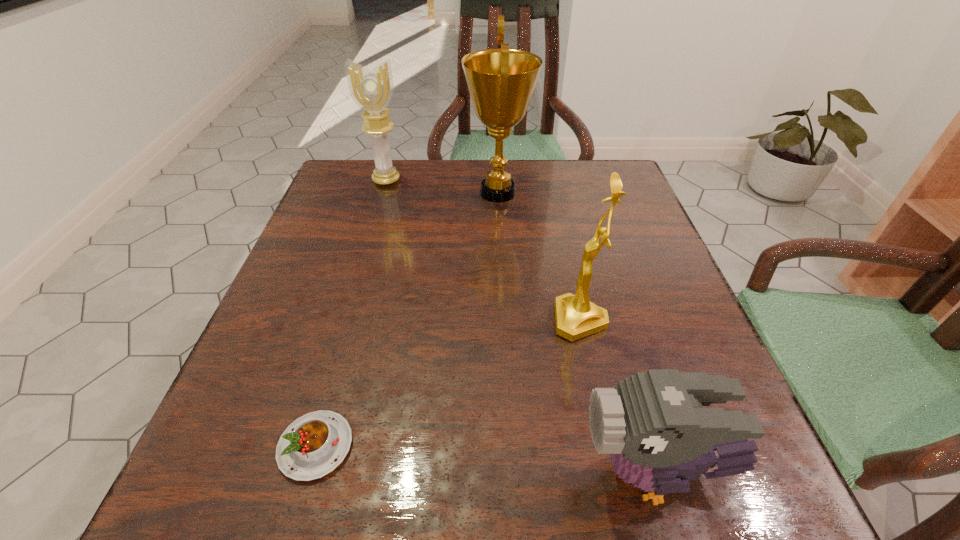
Identify the location of vacant space located on the front-facing side of the leftmost award. (358, 278).

In order to click on vacant area located 0.050m on the front-facing side of the rightmost award in this screenshot , I will do `click(525, 320)`.

Image resolution: width=960 pixels, height=540 pixels. What are the coordinates of `blank space located on the front-facing side of the rightmost award` in the screenshot? It's located at (419, 320).

Find the location of a particular element. free space located on the front-facing side of the rightmost award is located at coordinates (424, 320).

At what (x,y) coordinates should I click in order to perform the action: click on free location located 0.350m at the beak of the second shortest object. Please return your answer as a coordinate pair (x, y). Looking at the image, I should click on pyautogui.click(x=315, y=475).

I want to click on free location located at the beak of the second shortest object, so click(368, 475).

This screenshot has height=540, width=960. I want to click on vacant space situated at the beak of the second shortest object, so click(x=391, y=475).

You are a GUI agent. You are given a task and a screenshot of the screen. Output one action in this format:
    pyautogui.click(x=<x>, y=<y>)
    Task: Click on the vacant space located on the back of the shortest object
    This screenshot has height=540, width=960.
    Given the screenshot: What is the action you would take?
    [x=372, y=244]

Where is `bird located at the near edge`? bird located at the near edge is located at coordinates pyautogui.click(x=653, y=424).

Identify the location of pudding at the near edge. This screenshot has width=960, height=540. (312, 446).